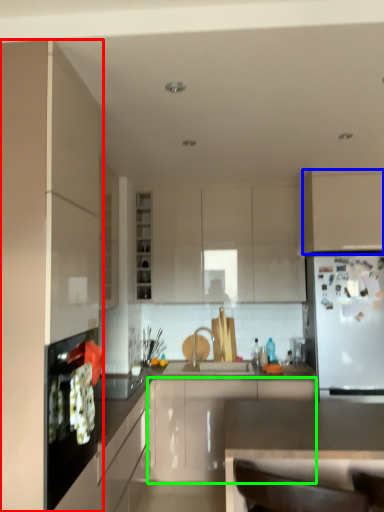
Question: Estimate the real-world distances between objects in this image. Which object is closer to cabinetry (highlighted by a red box), cabinetry (highlighted by a blue box) or cabinetry (highlighted by a green box)?

Choices:
 (A) cabinetry
 (B) cabinetry

Answer: (B)